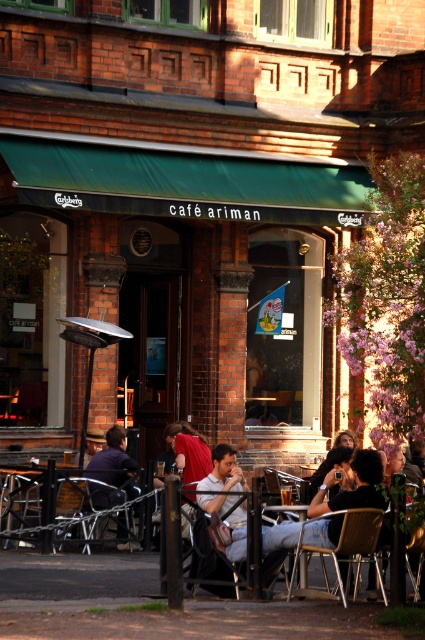
How far apart are dark purple shirt at center and metallic gold chair at lower center?

dark purple shirt at center is 4.45 meters away from metallic gold chair at lower center.

Is point (116, 428) positioned in front of point (357, 516)?

No, (116, 428) is behind (357, 516).

Does point (121, 493) lie in front of point (359, 545)?

No.

Identify the location of dark purple shirt at center. (113, 460).

Describe the element at coordinates (343, 499) in the screenshot. This screenshot has height=640, width=425. I see `matte black jacket at center` at that location.

Does point (320, 541) come farther from viewer compared to point (113, 444)?

No, it is not.

What do you see at coordinates (343, 499) in the screenshot? This screenshot has height=640, width=425. I see `matte black jacket at center` at bounding box center [343, 499].

Where is `matte black jacket at center`? The image size is (425, 640). matte black jacket at center is located at coordinates click(343, 499).

Between point (84, 490) and point (356, 524), which one is positioned in front?

Positioned in front is point (356, 524).

Between point (93, 492) and point (371, 518), which one is positioned in front?

Point (371, 518) is in front.

What are the coordinates of `metallic silver chair at center` in the screenshot? It's located at (99, 506).